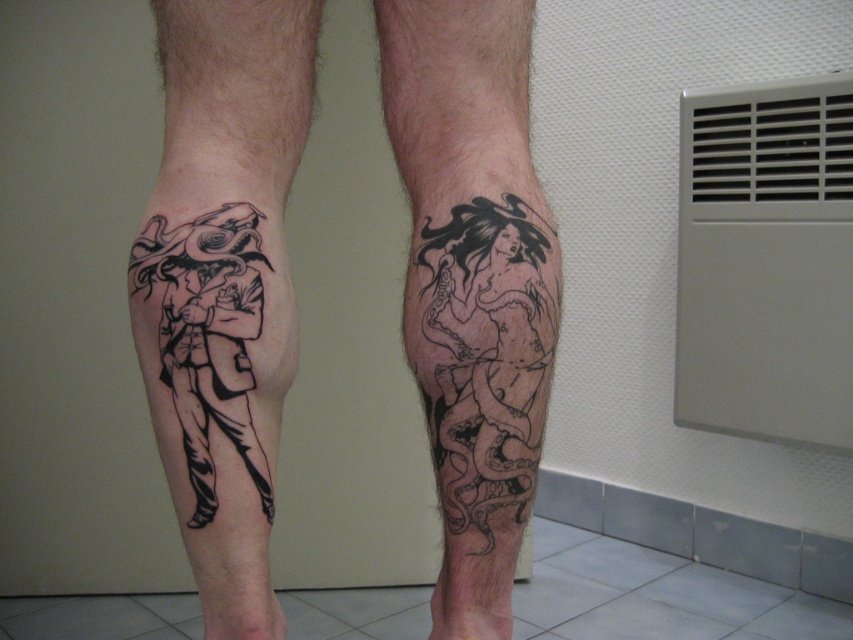
Is point (167, 237) less distant than point (502, 305)?

That is False.

Identify the location of black ink tattoo at lower left. (223, 285).

Who is more distant from viewer, (262, 496) or (444, 525)?

Positioned behind is point (444, 525).

You are a GUI agent. You are given a task and a screenshot of the screen. Output one action in this format:
    pyautogui.click(x=<x>, y=<y>)
    Task: Click on the black ink tattoo at lower left
    This screenshot has width=853, height=640.
    Given the screenshot: What is the action you would take?
    pyautogui.click(x=223, y=285)

Between point (225, 340) and point (444, 148), which one is positioned behind?

The point (444, 148) is more distant.

Is point (198, 460) positioned before point (434, 198)?

Yes.

What do you see at coordinates (223, 285) in the screenshot?
I see `black ink tattoo at lower left` at bounding box center [223, 285].

This screenshot has height=640, width=853. I want to click on black ink tattoo at lower left, so click(223, 285).

The image size is (853, 640). What do you see at coordinates (473, 284) in the screenshot?
I see `black ink tattoo at lower center` at bounding box center [473, 284].

Is point (508, 70) closer to camera compared to point (526, 374)?

No, it is behind (526, 374).

Locate an element on the screen. This screenshot has height=640, width=853. black ink tattoo at lower center is located at coordinates (473, 284).